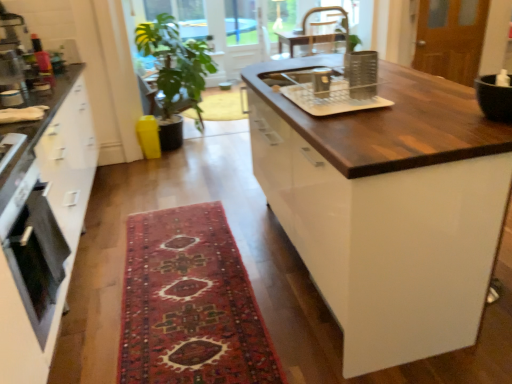
The width and height of the screenshot is (512, 384). Identify the location of blank space situated above carpeted rug at center (from a real-world perspective). (187, 277).